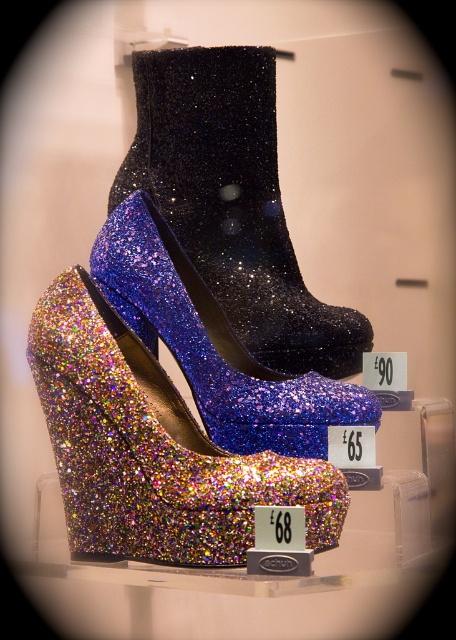
Question: Estimate the real-world distances between objects in this image. Which object is farther from the glittery black boot at center?

Choices:
 (A) glittery multicolor platform shoe at center
 (B) glittery blue platform shoe at center

Answer: (A)

Question: Which is nearer to the glittery blue platform shoe at center?

Choices:
 (A) glittery black boot at center
 (B) glittery multicolor platform shoe at center

Answer: (A)

Question: Which of the following is the closest to the observer?

Choices:
 (A) (119, 388)
 (B) (257, 113)

Answer: (A)

Question: Does glittery multicolor platform shoe at center appear on the right side of glittery blue platform shoe at center?

Choices:
 (A) yes
 (B) no

Answer: (B)

Question: Is glittery black boot at center thinner than glittery blue platform shoe at center?

Choices:
 (A) no
 (B) yes

Answer: (B)

Question: Can you confirm if glittery multicolor platform shoe at center is thinner than glittery black boot at center?

Choices:
 (A) yes
 (B) no

Answer: (B)